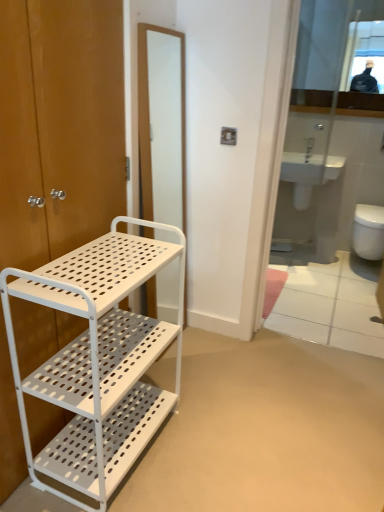
This screenshot has height=512, width=384. Identify the location of vacant space underneath white plastic bidet at center (from a real-world perspective). (297, 244).